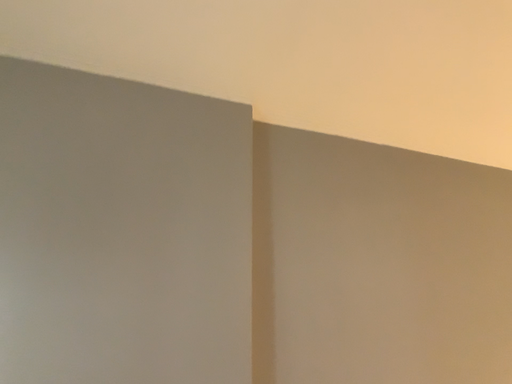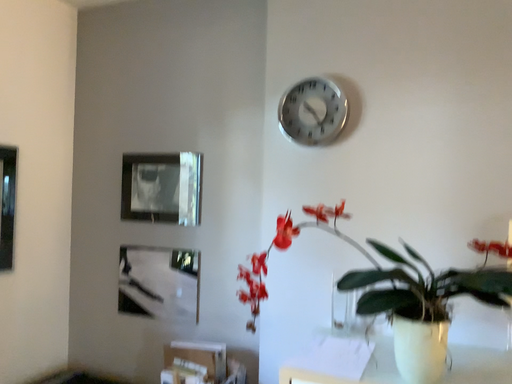
Question: Which way did the camera rotate in the video?

Choices:
 (A) rotated downward
 (B) rotated upward

Answer: (A)